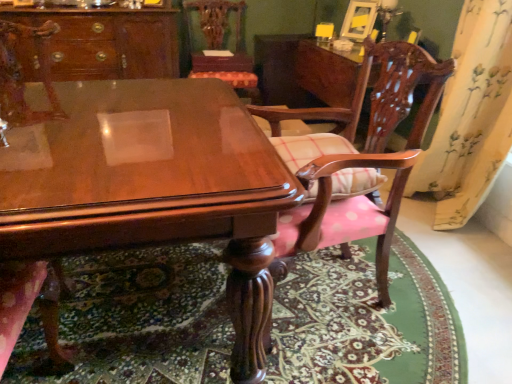
Find the location of a particular element. Image resolution: width=512 pixels, height=384 pixels. free area below yellow floral fabric at right (from a real-world perspective) is located at coordinates (444, 225).